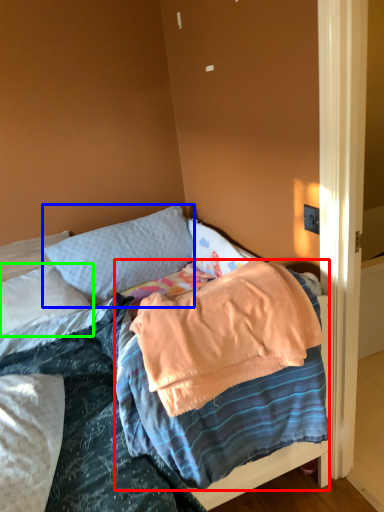
Question: Which is nearer to the blanket (highlighted by a red box)? pillow (highlighted by a blue box) or pillow (highlighted by a green box).

Choices:
 (A) pillow
 (B) pillow

Answer: (B)